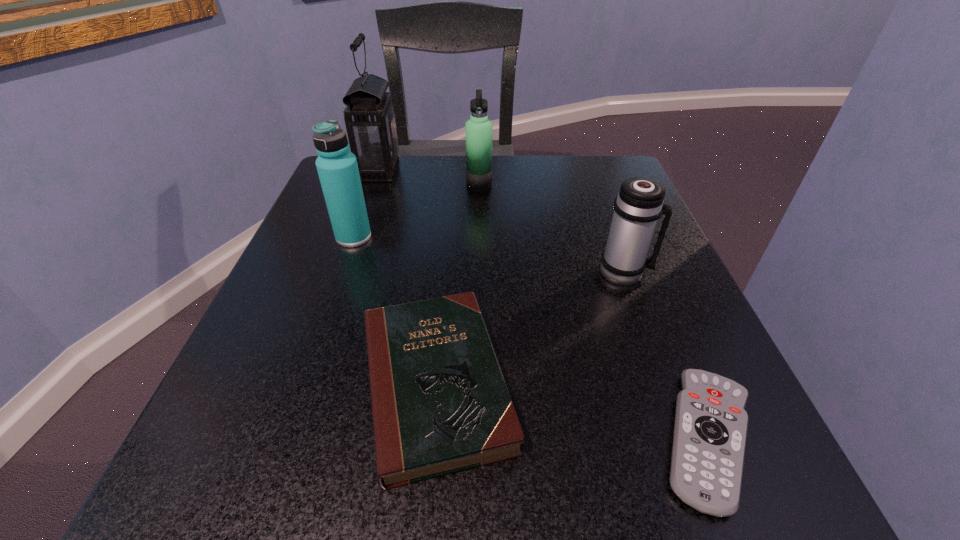
Where is `empty space that is in between the tallest object and the rightmost thermos bottle`? This screenshot has height=540, width=960. empty space that is in between the tallest object and the rightmost thermos bottle is located at coordinates (502, 221).

The width and height of the screenshot is (960, 540). Find the location of `free space between the remote control and the lantern`. free space between the remote control and the lantern is located at coordinates (543, 305).

Locate an element on the screen. free space between the second nearest thermos bottle and the shortest object is located at coordinates (531, 338).

You are a GUI agent. You are given a task and a screenshot of the screen. Output one action in this format:
    pyautogui.click(x=<x>, y=<y>)
    Task: Click on the free space between the remote control and the farthest thermos bottle
    The height and width of the screenshot is (540, 960).
    Given the screenshot: What is the action you would take?
    pyautogui.click(x=594, y=312)

This screenshot has width=960, height=540. I want to click on empty location between the farthest thermos bottle and the Bible, so click(x=457, y=285).

You are a GUI agent. You are given a task and a screenshot of the screen. Output one action in this format:
    pyautogui.click(x=<x>, y=<y>)
    Task: Click on the free point between the second nearest thermos bottle and the second thermos bottle from right to left
    The height and width of the screenshot is (540, 960).
    Given the screenshot: What is the action you would take?
    click(417, 211)

You are a GUI agent. You are given a task and a screenshot of the screen. Output one action in this format:
    pyautogui.click(x=<x>, y=<y>)
    Task: Click on the empty space that is in between the tallest object and the second thermos bottle from left to right
    This screenshot has width=960, height=540.
    Given the screenshot: What is the action you would take?
    pyautogui.click(x=429, y=178)

I want to click on free space between the second nearest thermos bottle and the lantern, so click(x=367, y=204).

Locate an element on the screen. The width and height of the screenshot is (960, 540). vacant area that lies between the fifth tallest object and the second thermos bottle from left to right is located at coordinates (457, 285).

Find the location of a particular element. free space between the lantern and the third shortest object is located at coordinates (502, 221).